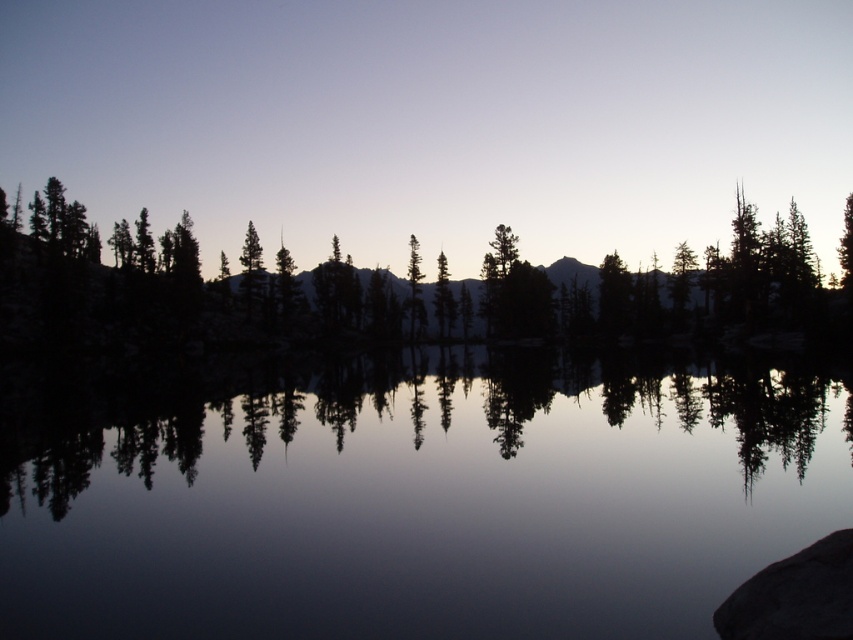
You are an artist trying to sketch this scene. You want to ensure the transparent water at center and the silhouette tree at left are proportionally accurate. Which object should you draw first to maintain the correct size relationship between them?

A: You should draw the silhouette tree at left first because the transparent water at center is smaller than it, so starting with the larger object ensures proper scaling when adding the smaller one.

You are an artist trying to paint this scene. You need to decide which object to paint first based on their sizes. Which object should you start with, the transparent water at center or the black rock at lower right?

The transparent water at center is larger in size than the black rock at lower right, so you should start with the transparent water at center since it covers more area and requires more attention.